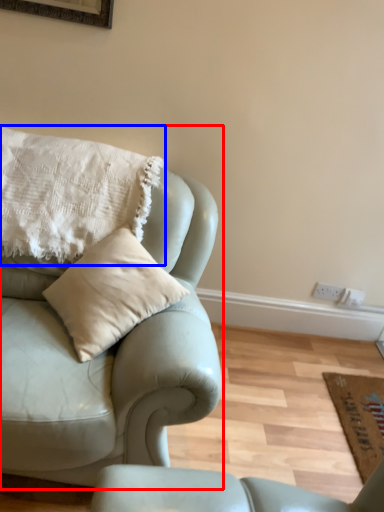
Question: Which point is closer to the camera, studio couch (highlighted by a red box) or pillow (highlighted by a blue box)?

Choices:
 (A) studio couch
 (B) pillow

Answer: (A)